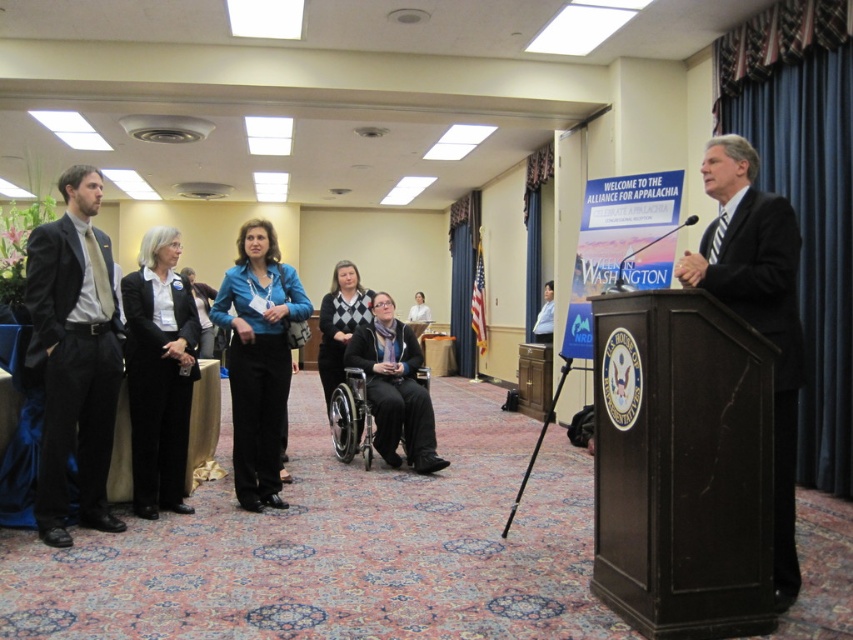
You are standing at the point labeled point (x=757, y=310) in the image. What object are you facing directly?

The point labeled point (x=757, y=310) corresponds to the dark suit at right, so you are facing the dark suit at right directly.

You are a photographer trying to capture a clear photo of the matte black suit at left during the event. The camera you are using has a minimum focusing distance of 10 feet. Can you take the photo without moving closer than the current position?

The matte black suit at left and camera are 11.37 feet apart from each other. Since the minimum focusing distance is 10 feet, the photographer can take the photo without moving closer because the distance is sufficient.

You are organizing a photo shoot and need to arrange two subjects, the dark suit at right and the blue shirt at center, so that they are aligned horizontally. Given their height difference, which subject should be placed closer to the camera to ensure proper alignment?

The dark suit at right has a greater height compared to blue shirt at center. To align them horizontally, the taller dark suit at right should be placed closer to the camera while the shorter blue shirt at center should be positioned further back.